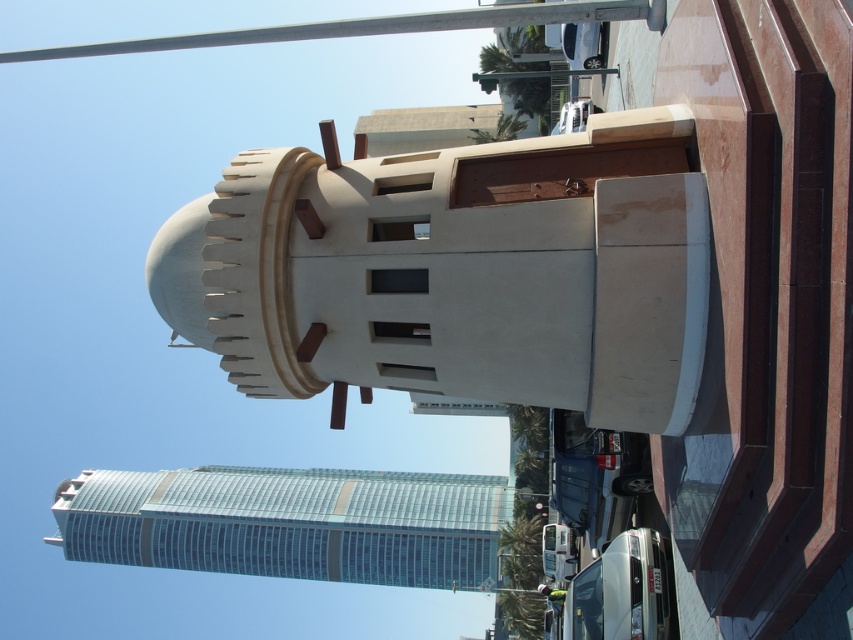
Is metallic pole at upper center to the left of white glossy bus at lower center from the viewer's perspective?

Yes, metallic pole at upper center is to the left of white glossy bus at lower center.

Does metallic pole at upper center come behind white glossy bus at lower center?

No, metallic pole at upper center is in front of white glossy bus at lower center.

Is point (526, 17) behind point (664, 572)?

No, it is not.

This screenshot has width=853, height=640. Find the location of `metallic pole at upper center`. metallic pole at upper center is located at coordinates (372, 28).